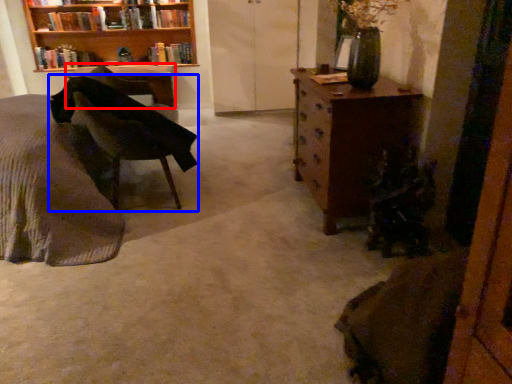
Question: Which point is closer to the camera, desk (highlighted by a red box) or chair (highlighted by a blue box)?

Choices:
 (A) desk
 (B) chair

Answer: (B)